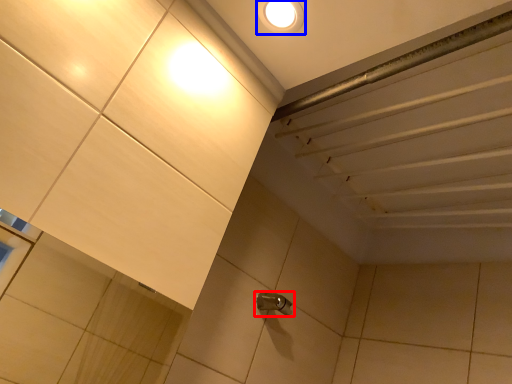
Question: Which object appears farthest to the camera in this image, plumbing fixture (highlighted by a red box) or droplight (highlighted by a blue box)?

Choices:
 (A) plumbing fixture
 (B) droplight

Answer: (A)